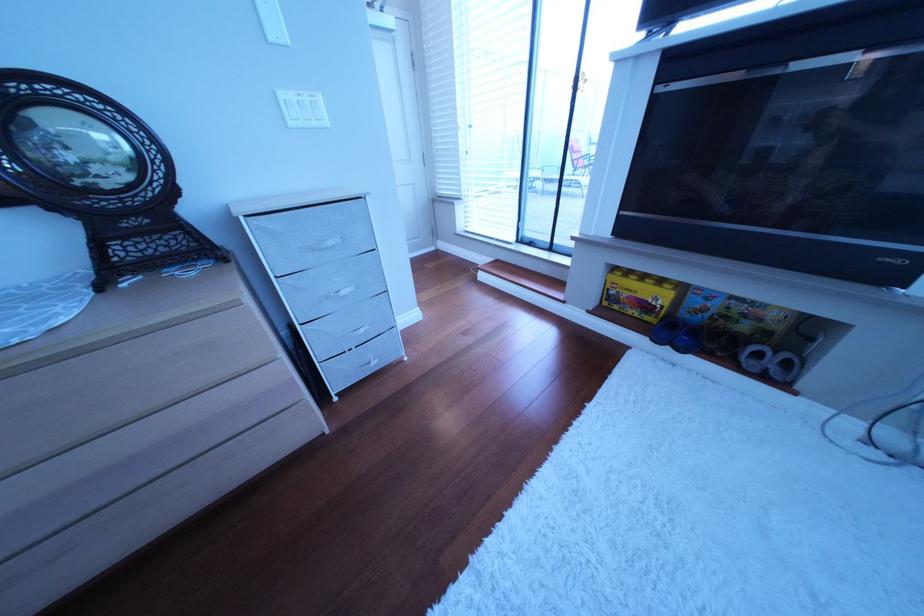
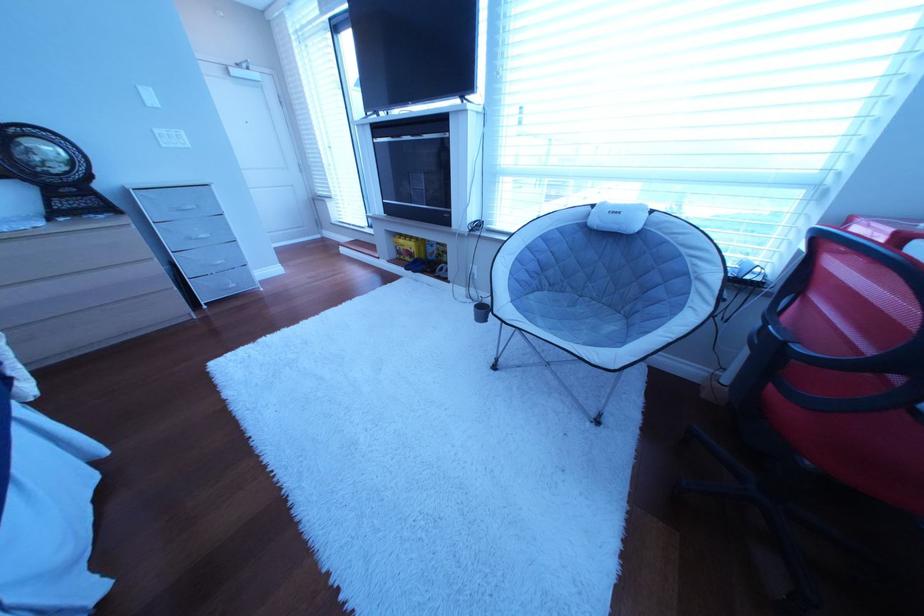
In the second image, find the point that corresponds to (640,296) in the first image.

(418, 251)